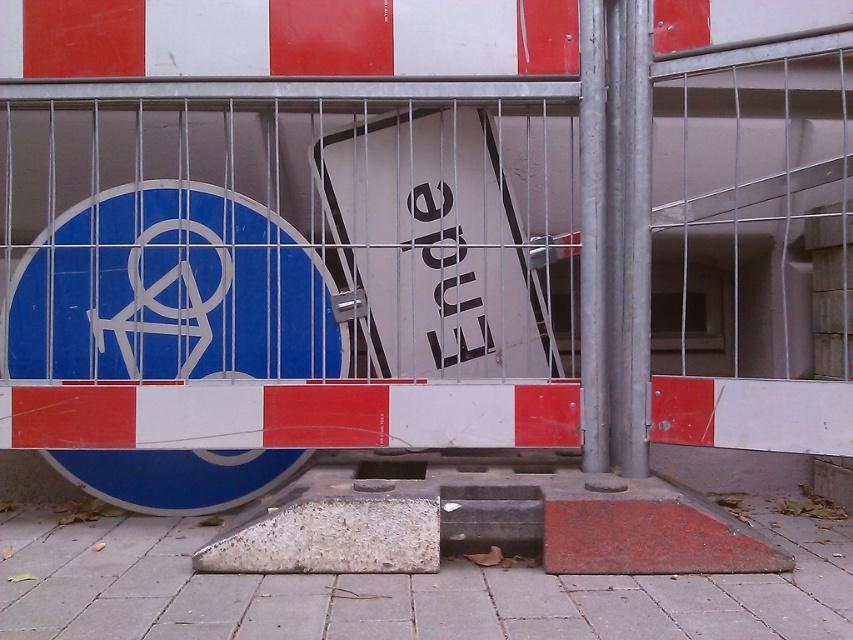
Question: Does concrete pavement at center have a greater width compared to white matte sign at center?

Choices:
 (A) no
 (B) yes

Answer: (B)

Question: Which point appears farthest from the camera in this image?

Choices:
 (A) (407, 273)
 (B) (793, 525)

Answer: (A)

Question: Is concrete pavement at center wider than white matte sign at center?

Choices:
 (A) yes
 (B) no

Answer: (A)

Question: Among these points, which one is nearest to the camera?

Choices:
 (A) (x=73, y=529)
 (B) (x=422, y=163)

Answer: (A)

Question: Which point appears closest to the camera in this image?

Choices:
 (A) (262, 586)
 (B) (506, 340)

Answer: (A)

Question: Does concrete pavement at center appear over white matte sign at center?

Choices:
 (A) yes
 (B) no

Answer: (B)